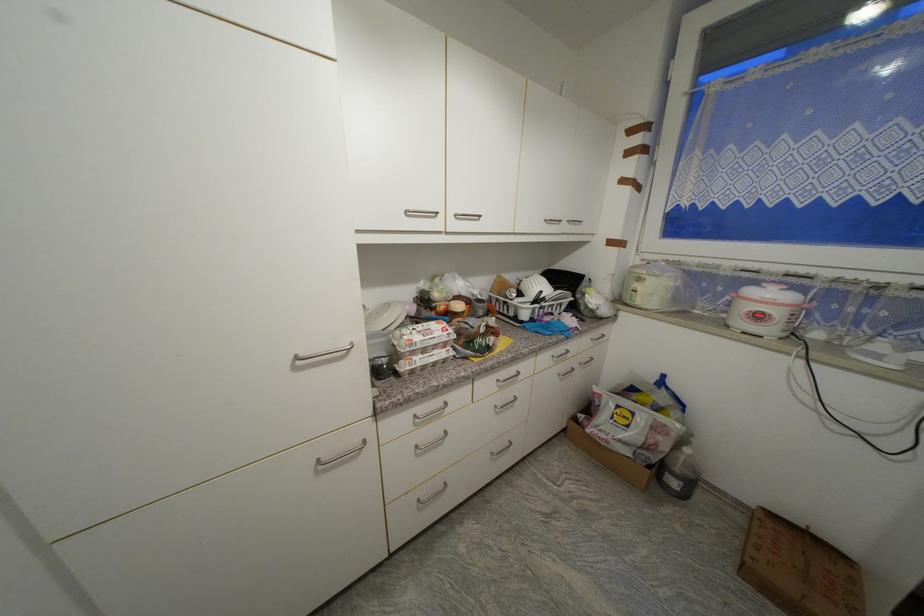
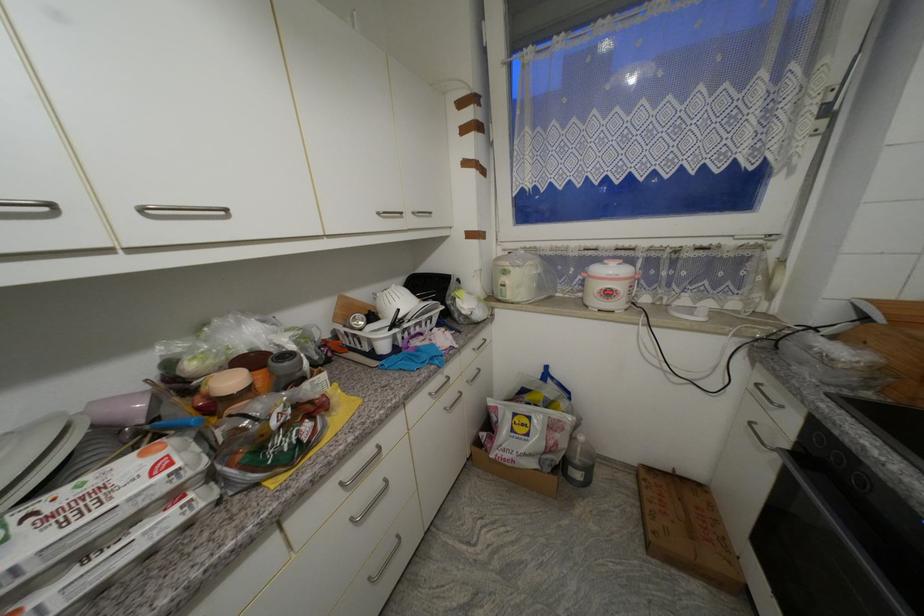
In a continuous first-person perspective shot, in which direction is the camera moving?

The cameraman moved toward right, forward.